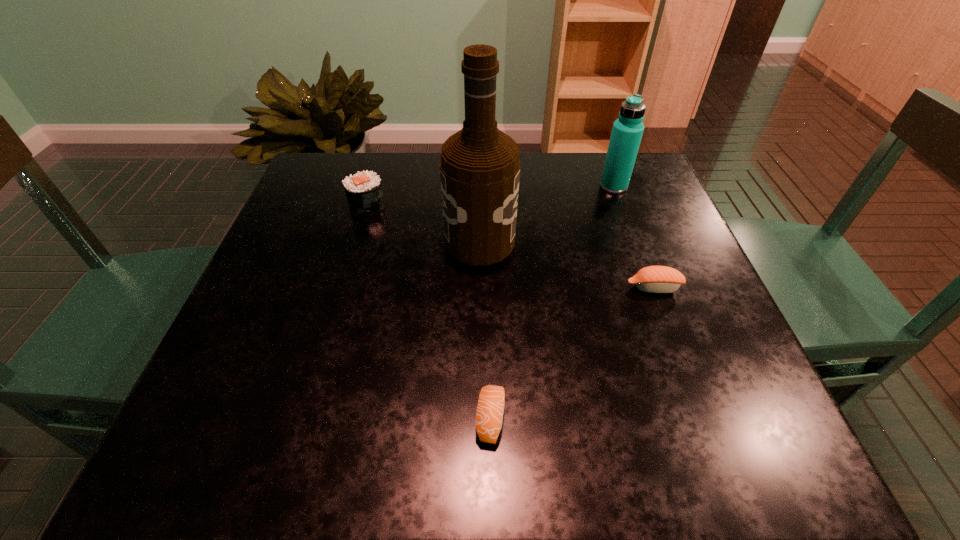
Locate which sushi is the closest to the tallest object. Please provide its 2D coordinates. Your answer should be formatted as a tuple, i.e. [(x, y)], where the tuple contains the x and y coordinates of a point satisfying the conditions above.

[(363, 190)]

Identify the location of vacant area in the image that satisfies the following two spatial constraints: 1. on the front side of the tallest sushi; 2. on the right side of the fourth farthest object. (343, 288).